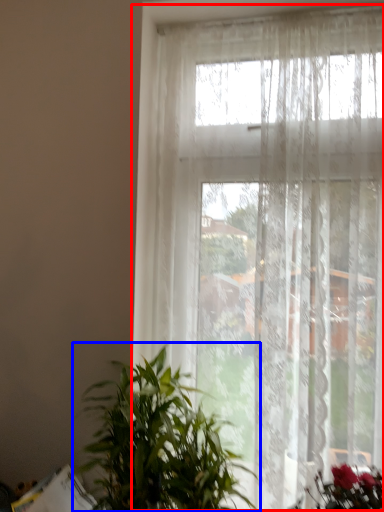
Question: Which object appears closest to the camera in this image, window (highlighted by a red box) or houseplant (highlighted by a blue box)?

Choices:
 (A) window
 (B) houseplant

Answer: (B)